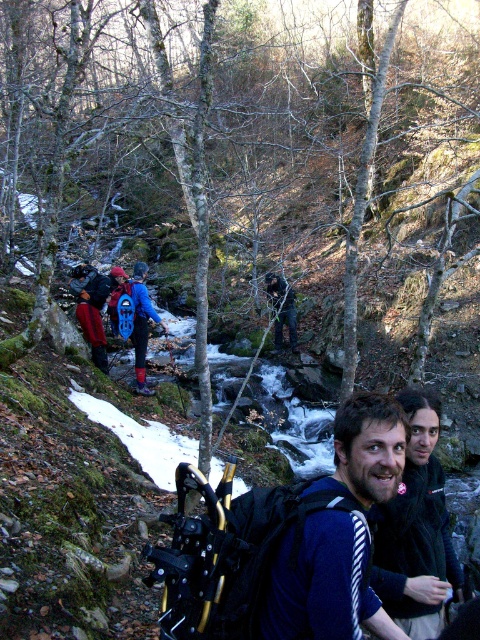
Is blue striped sweater at center to the left of blue waterproof jacket at center from the viewer's perspective?

Incorrect, blue striped sweater at center is not on the left side of blue waterproof jacket at center.

Does blue striped sweater at center have a lesser width compared to blue waterproof jacket at center?

Correct, blue striped sweater at center's width is less than blue waterproof jacket at center's.

The height and width of the screenshot is (640, 480). Identify the location of blue striped sweater at center. (339, 534).